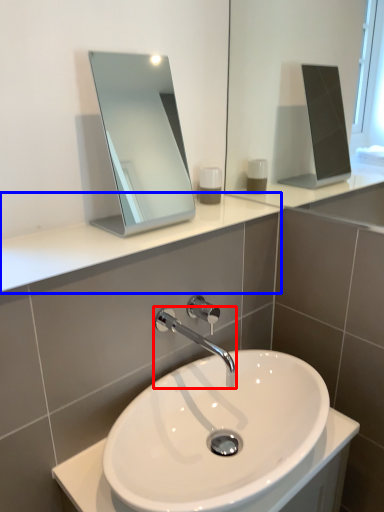
Question: Which object appears farthest to the camera in this image, tap (highlighted by a red box) or counter top (highlighted by a blue box)?

Choices:
 (A) tap
 (B) counter top

Answer: (A)